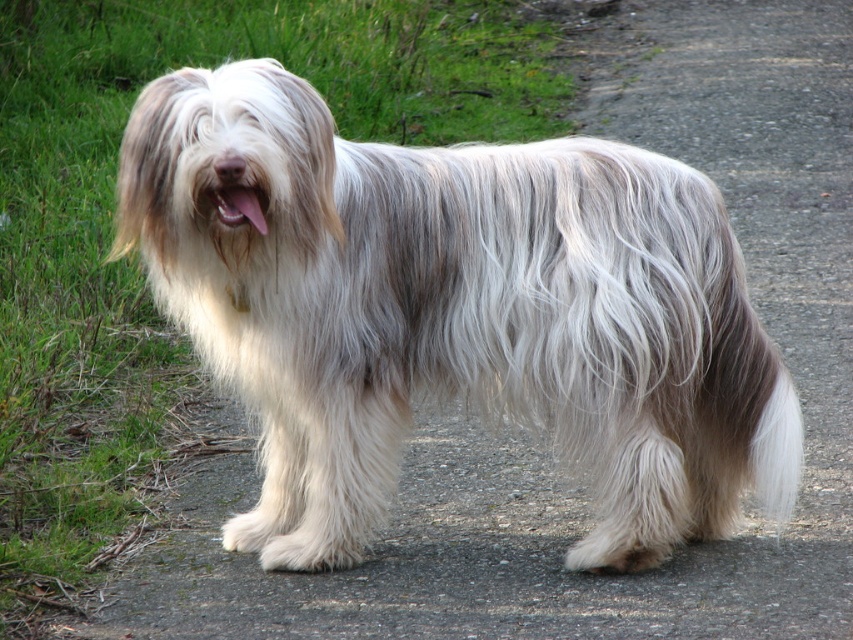
Is the position of white fluffy tail at lower right more distant than that of pink fur at center?

That is True.

Locate an element on the screen. The width and height of the screenshot is (853, 640). white fluffy tail at lower right is located at coordinates (776, 451).

Can you confirm if fuzzy white dog at center is thinner than pink fur at center?

Incorrect, fuzzy white dog at center's width is not less than pink fur at center's.

Is fuzzy white dog at center wider than pink fur at center?

Correct, the width of fuzzy white dog at center exceeds that of pink fur at center.

Is point (292, 337) positioned after point (225, 212)?

Yes, point (292, 337) is farther from viewer.

Locate an element on the screen. The width and height of the screenshot is (853, 640). fuzzy white dog at center is located at coordinates (445, 308).

Does fuzzy white dog at center have a greater width compared to white fluffy tail at lower right?

Correct, the width of fuzzy white dog at center exceeds that of white fluffy tail at lower right.

Which is more to the left, fuzzy white dog at center or white fluffy tail at lower right?

From the viewer's perspective, fuzzy white dog at center appears more on the left side.

Is point (625, 561) positioned after point (763, 480)?

Yes, point (625, 561) is behind point (763, 480).

The width and height of the screenshot is (853, 640). Find the location of `fuzzy white dog at center`. fuzzy white dog at center is located at coordinates (445, 308).